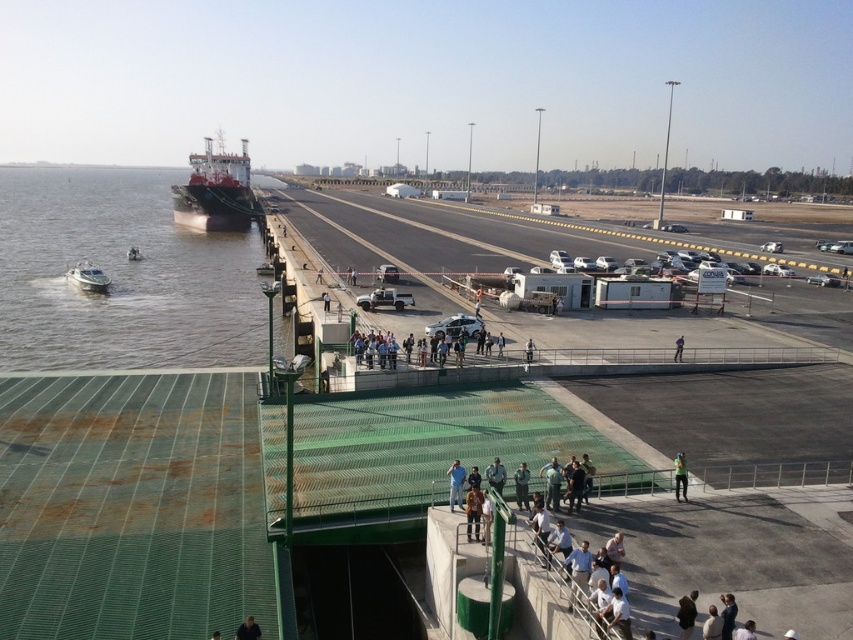
Question: Is dark green uniform at center to the right of blue fabric jacket at center from the viewer's perspective?

Choices:
 (A) no
 (B) yes

Answer: (A)

Question: Which point appears farthest from the camera in this image?

Choices:
 (A) (323, 301)
 (B) (248, 628)
 (C) (495, 490)
 (D) (675, 358)

Answer: (A)

Question: Estimate the real-world distances between objects in this image. Which object is closer to the dark gray uniform at center?

Choices:
 (A) brown water at lower left
 (B) dark green uniform at center

Answer: (B)

Question: Which object appears closest to the camera in this image?

Choices:
 (A) green fabric at center
 (B) white fabric shirt at lower center
 (C) blue fabric jacket at center

Answer: (B)

Question: Does dark gray uniform at center lie behind green mesh fence at center?

Choices:
 (A) yes
 (B) no

Answer: (B)

Question: Is dark green uniform at center in front of dark blue shirt at center?

Choices:
 (A) yes
 (B) no

Answer: (B)